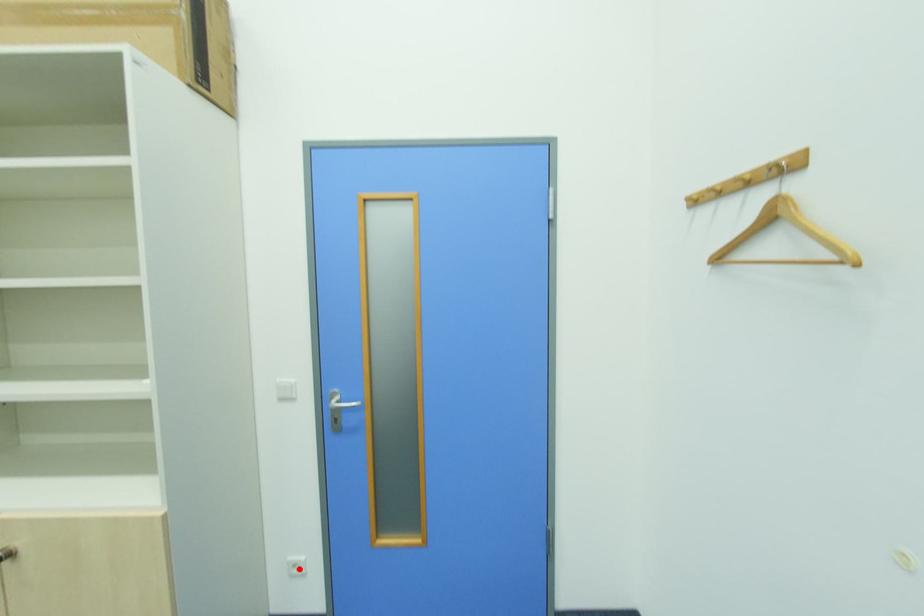
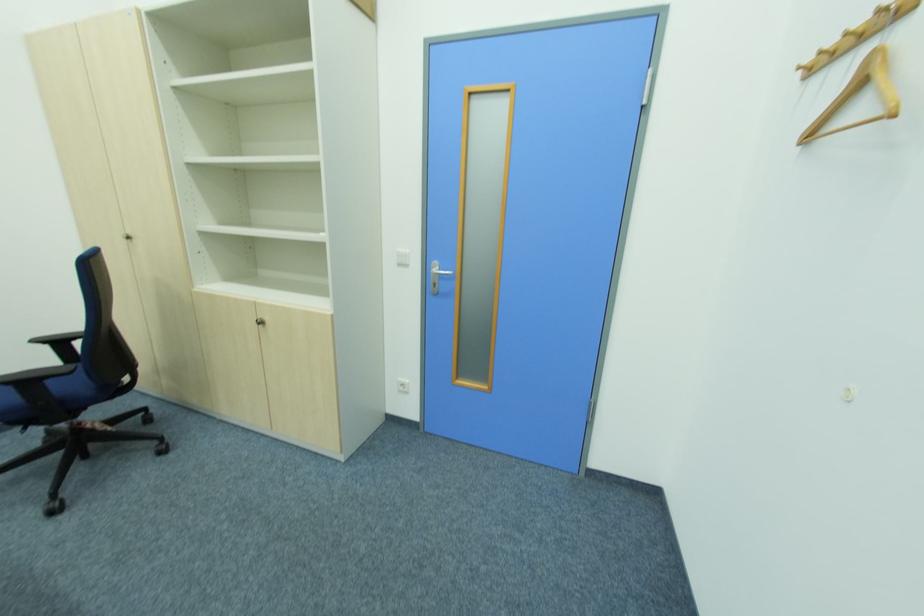
Find the pixel in the second image that matches the highlighted location in the first image.

(407, 387)